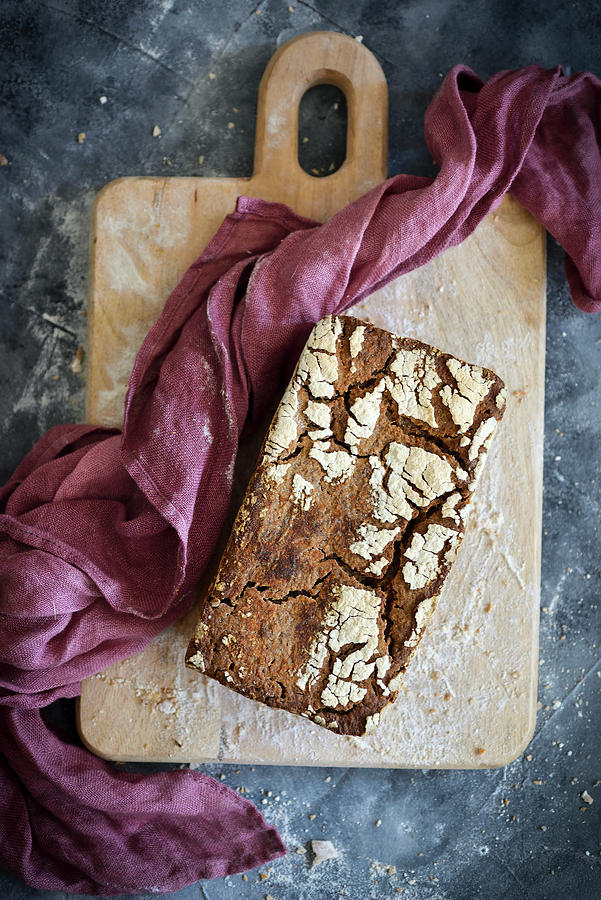
Where is `purple towel`? The image size is (601, 900). purple towel is located at coordinates (498, 150).